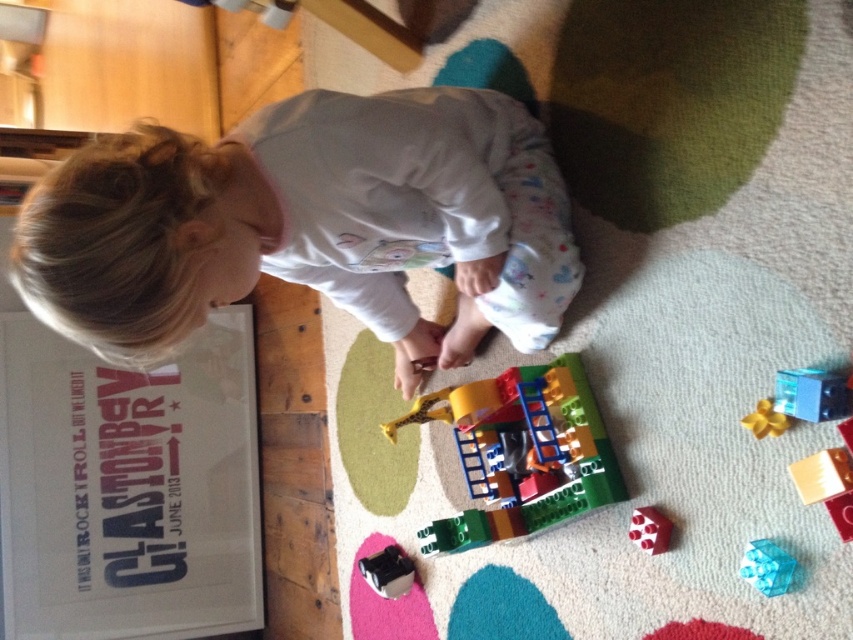
The child is playing with two toys. The translucent plastic building at center and the black plastic toy at lower center. Which toy is positioned higher in the image?

The translucent plastic building at center is positioned higher than the black plastic toy at lower center.

You are a parent observing your child playing with the transparent plastic cube at lower right and the black plastic toy at lower center. Which toy is shorter?

The transparent plastic cube at lower right is shorter than the black plastic toy at lower center.

Where is the translucent plastic building at center located in the image?

The translucent plastic building at center is located at point (520,452) in the image.